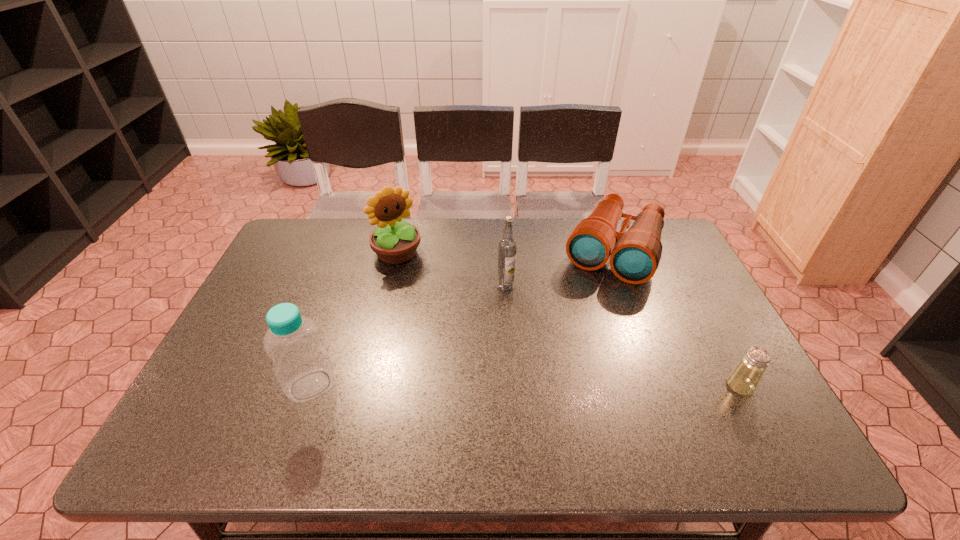
This screenshot has width=960, height=540. In order to click on vacant spot on the desktop that is between the bottle and the saltshaker and is positioned on the label of the third object from right to left in this screenshot , I will do `click(518, 386)`.

Find the location of a particular element. This screenshot has height=540, width=960. vacant spot on the desktop that is between the bottle and the saltshaker and is positioned on the face of the sunflower is located at coordinates (512, 386).

Where is `vacant spot on the desktop that is between the bottle and the shortest object and is positioned through the lenses of the binoculars`? vacant spot on the desktop that is between the bottle and the shortest object and is positioned through the lenses of the binoculars is located at coordinates coord(550,386).